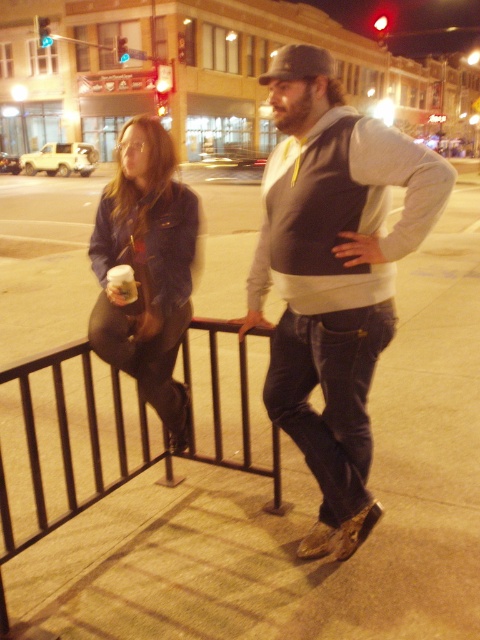
You are a delivery person who needs to place a large package on the ground. You see the brown concrete pavement at center and the gray hoodie at center in the image. Which surface can accommodate the package more comfortably?

The brown concrete pavement at center has a larger size compared to the gray hoodie at center, so the package can be placed more comfortably on the brown concrete pavement at center.

You are a photographer trying to capture both the gray hoodie at center and the denim jacket at left in a single frame. Based on their positions and sizes, do you think they will both fit within the camera frame if you adjust the zoom appropriately?

The gray hoodie at center might be wider than denim jacket at left, so adjusting the zoom to accommodate the wider gray hoodie at center should allow both to fit in the frame.